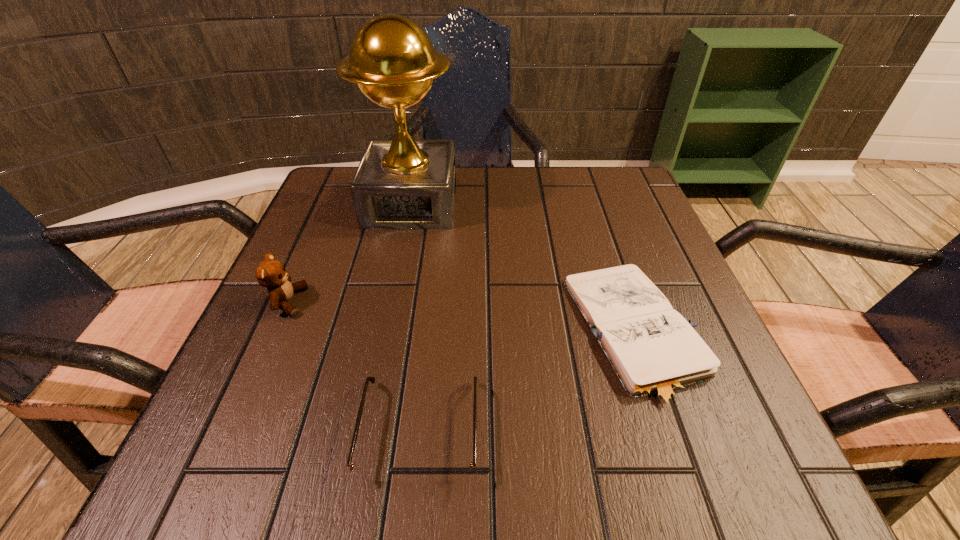
Where is `free space at the far right corner`? Image resolution: width=960 pixels, height=540 pixels. free space at the far right corner is located at coordinates (572, 165).

Identify the location of unoccupied position between the shortest object and the tallest object. (524, 268).

Find the location of a particular element. This screenshot has width=960, height=540. empty location between the rightmost object and the farthest object is located at coordinates (524, 268).

Locate an element on the screen. The height and width of the screenshot is (540, 960). vacant space in between the third tallest object and the leftmost object is located at coordinates (354, 367).

Where is `vacant area between the notebook and the award`? Image resolution: width=960 pixels, height=540 pixels. vacant area between the notebook and the award is located at coordinates tap(524, 268).

Where is `free space between the tallest object and the second shortest object`? free space between the tallest object and the second shortest object is located at coordinates (416, 318).

This screenshot has width=960, height=540. Find the location of `vacant space that's between the shortest object and the teddy bear`. vacant space that's between the shortest object and the teddy bear is located at coordinates (463, 317).

Where is `empty space between the spectacles and the shortest object`? empty space between the spectacles and the shortest object is located at coordinates (529, 382).

Identify the location of vacant area between the spectacles and the farthest object. (416, 318).

Find the location of a particular element. free area in between the spectacles and the award is located at coordinates (416, 318).